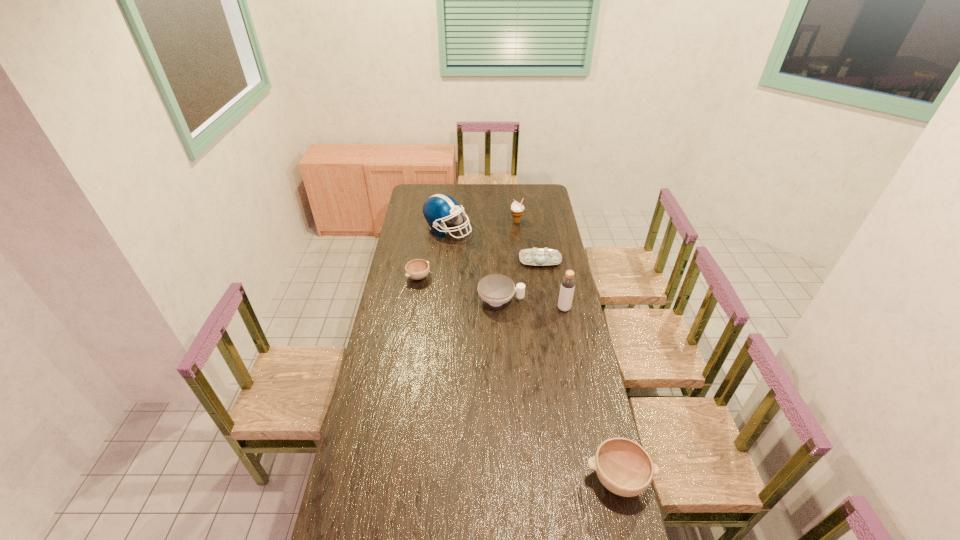
Locate an element on the screen. vacant region that satisfies the following two spatial constraints: 1. on the front side of the bottle; 2. on the right side of the icecream is located at coordinates (526, 308).

The height and width of the screenshot is (540, 960). Identify the location of free space that satisfies the following two spatial constraints: 1. on the back side of the farther chinaware; 2. at the front of the football helmet with the faceguard. (535, 230).

Locate an element on the screen. Image resolution: width=960 pixels, height=540 pixels. vacant space that satisfies the following two spatial constraints: 1. on the back side of the third farthest object; 2. at the front of the football helmet with the faceguard is located at coordinates (535, 230).

This screenshot has height=540, width=960. What are the coordinates of `free point that satisfies the following two spatial constraints: 1. on the back side of the bottle; 2. at the front of the football helmet with the faceguard` in the screenshot? It's located at (548, 230).